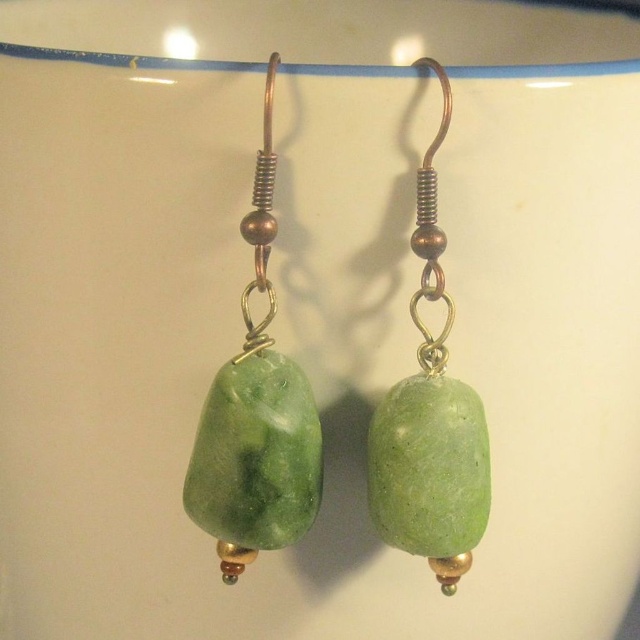
Question: Which point is farther to the camera?

Choices:
 (A) green stone earring at left
 (B) green stone earring at center

Answer: (B)

Question: Does green stone earring at left appear on the left side of green stone earring at center?

Choices:
 (A) yes
 (B) no

Answer: (A)

Question: Which point is farther to the camera?

Choices:
 (A) (291, 518)
 (B) (378, 420)

Answer: (B)

Question: Which point is closer to the camera?

Choices:
 (A) green stone earring at left
 (B) green stone earring at center

Answer: (A)

Question: From the image, what is the correct spatial relationship of green stone earring at left in relation to green stone earring at center?

Choices:
 (A) right
 (B) left

Answer: (B)

Question: From the image, what is the correct spatial relationship of green stone earring at left in relation to green stone earring at center?

Choices:
 (A) below
 (B) above

Answer: (B)